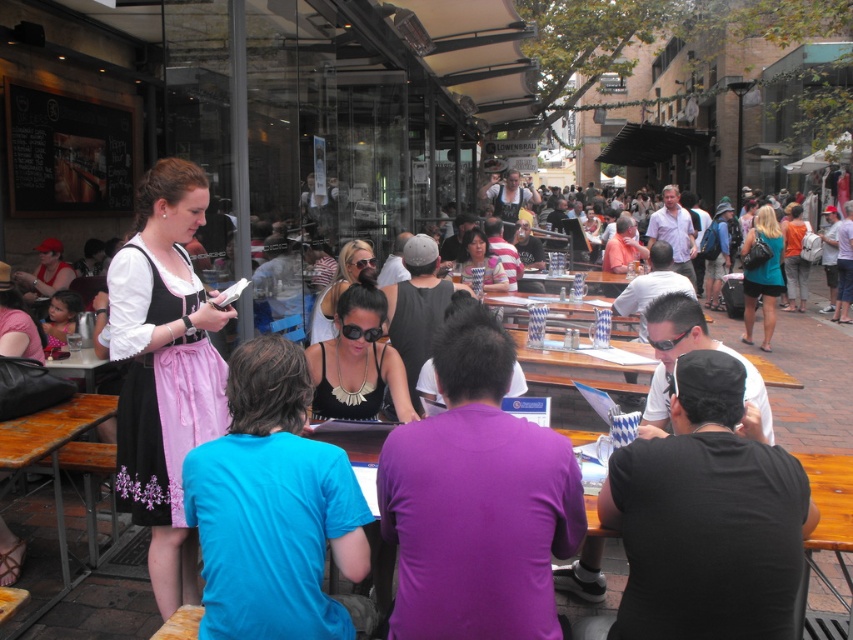
Question: Is matte black dirndl at left above wooden table at center?

Choices:
 (A) yes
 (B) no

Answer: (A)

Question: Is purple matte shirt at center thinner than blue cotton shirt at center?

Choices:
 (A) yes
 (B) no

Answer: (B)

Question: Considering the real-world distances, which object is farthest from the wooden table at lower left?

Choices:
 (A) matte black dirndl at left
 (B) wooden table at center
 (C) black matte shirt at lower right

Answer: (B)

Question: Which point appears farthest from the camera in this image?

Choices:
 (A) (840, 525)
 (B) (717, 424)
 (C) (13, 452)

Answer: (C)

Question: Is blue cotton shirt at center behind matte black dirndl at left?

Choices:
 (A) yes
 (B) no

Answer: (B)

Question: Which of the following is the closest to the observer?

Choices:
 (A) pos(279,577)
 (B) pos(792,477)
 (C) pos(489,340)

Answer: (A)